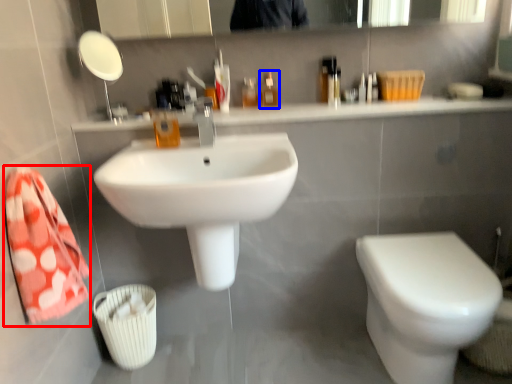
Question: Which of the following is the closest to the observer, bath towel (highlighted by a red box) or mouthwash (highlighted by a blue box)?

Choices:
 (A) bath towel
 (B) mouthwash

Answer: (A)